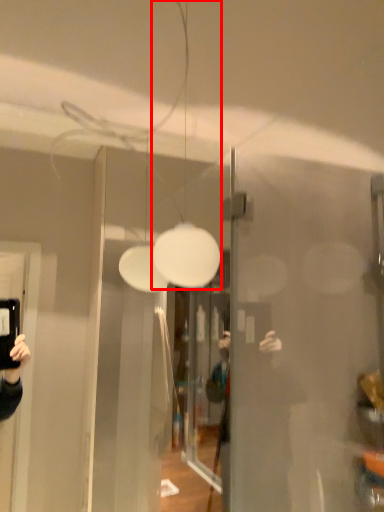
Question: From the image's perspective, considering the relative positions of light fixture (annotated by the red box) and glass door in the image provided, where is light fixture (annotated by the red box) located with respect to the staircase?

Choices:
 (A) below
 (B) above

Answer: (B)